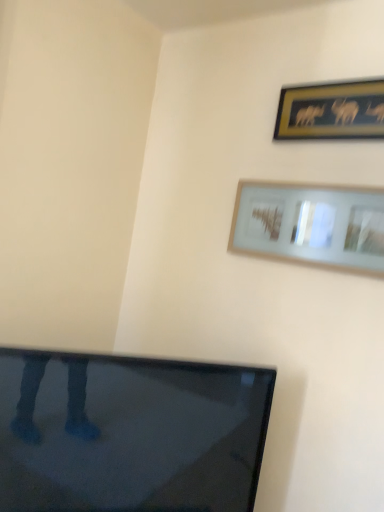
This screenshot has width=384, height=512. What do you see at coordinates (311, 224) in the screenshot?
I see `matte glass picture frame at upper right, which is the second picture frame in top-to-bottom order` at bounding box center [311, 224].

Where is `matte glass picture frame at upper right, which is the second picture frame in top-to-bottom order`? The height and width of the screenshot is (512, 384). matte glass picture frame at upper right, which is the second picture frame in top-to-bottom order is located at coordinates (311, 224).

The height and width of the screenshot is (512, 384). Describe the element at coordinates (332, 111) in the screenshot. I see `gold-framed picture at upper right, marked as the second picture frame in a bottom-to-top arrangement` at that location.

Find the location of a particular element. The image size is (384, 512). gold-framed picture at upper right, which appears as the first picture frame when viewed from the top is located at coordinates (332, 111).

This screenshot has height=512, width=384. In order to click on matte glass picture frame at upper right, which appears as the 1th picture frame when ordered from the bottom in this screenshot , I will do `click(311, 224)`.

Is gold-framed picture at upper right, which appears as the first picture frame when viewed from the top, at the left side of matte glass picture frame at upper right, which is the second picture frame in top-to-bottom order?

No, gold-framed picture at upper right, which appears as the first picture frame when viewed from the top, is not to the left of matte glass picture frame at upper right, which is the second picture frame in top-to-bottom order.

Considering their positions, is gold-framed picture at upper right, marked as the second picture frame in a bottom-to-top arrangement, located in front of or behind matte glass picture frame at upper right, which appears as the 1th picture frame when ordered from the bottom?

Visually, gold-framed picture at upper right, marked as the second picture frame in a bottom-to-top arrangement, is located behind matte glass picture frame at upper right, which appears as the 1th picture frame when ordered from the bottom.

Is point (352, 81) closer or farther from the camera than point (271, 241)?

Clearly, point (352, 81) is closer to the camera than point (271, 241).

From the image's perspective, which one is positioned higher, gold-framed picture at upper right, which appears as the first picture frame when viewed from the top, or matte glass picture frame at upper right, which appears as the 1th picture frame when ordered from the bottom?

gold-framed picture at upper right, which appears as the first picture frame when viewed from the top, is shown above in the image.

From a real-world perspective, which is physically below, gold-framed picture at upper right, which appears as the first picture frame when viewed from the top, or matte glass picture frame at upper right, which is the second picture frame in top-to-bottom order?

matte glass picture frame at upper right, which is the second picture frame in top-to-bottom order.

Based on the photo, does gold-framed picture at upper right, marked as the second picture frame in a bottom-to-top arrangement, have a lesser width compared to matte glass picture frame at upper right, which is the second picture frame in top-to-bottom order?

Correct, the width of gold-framed picture at upper right, marked as the second picture frame in a bottom-to-top arrangement, is less than that of matte glass picture frame at upper right, which is the second picture frame in top-to-bottom order.

Is gold-framed picture at upper right, which appears as the first picture frame when viewed from the top, taller or shorter than matte glass picture frame at upper right, which appears as the 1th picture frame when ordered from the bottom?

Considering their sizes, gold-framed picture at upper right, which appears as the first picture frame when viewed from the top, has less height than matte glass picture frame at upper right, which appears as the 1th picture frame when ordered from the bottom.

Looking at this image, is gold-framed picture at upper right, which appears as the first picture frame when viewed from the top, smaller than matte glass picture frame at upper right, which is the second picture frame in top-to-bottom order?

Correct, gold-framed picture at upper right, which appears as the first picture frame when viewed from the top, occupies less space than matte glass picture frame at upper right, which is the second picture frame in top-to-bottom order.

Choose the correct answer: Is gold-framed picture at upper right, which appears as the first picture frame when viewed from the top, inside matte glass picture frame at upper right, which is the second picture frame in top-to-bottom order, or outside it?

gold-framed picture at upper right, which appears as the first picture frame when viewed from the top, is not enclosed by matte glass picture frame at upper right, which is the second picture frame in top-to-bottom order.

Is gold-framed picture at upper right, marked as the second picture frame in a bottom-to-top arrangement, beside matte glass picture frame at upper right, which appears as the 1th picture frame when ordered from the bottom?

No, gold-framed picture at upper right, marked as the second picture frame in a bottom-to-top arrangement, is not in contact with matte glass picture frame at upper right, which appears as the 1th picture frame when ordered from the bottom.

Could you tell me if gold-framed picture at upper right, which appears as the first picture frame when viewed from the top, is turned towards matte glass picture frame at upper right, which is the second picture frame in top-to-bottom order?

No, gold-framed picture at upper right, which appears as the first picture frame when viewed from the top, is not aimed at matte glass picture frame at upper right, which is the second picture frame in top-to-bottom order.

How many degrees apart are the facing directions of gold-framed picture at upper right, which appears as the first picture frame when viewed from the top, and matte glass picture frame at upper right, which appears as the 1th picture frame when ordered from the bottom?

The angular difference between gold-framed picture at upper right, which appears as the first picture frame when viewed from the top, and matte glass picture frame at upper right, which appears as the 1th picture frame when ordered from the bottom, is 0.000173 degrees.

You are a GUI agent. You are given a task and a screenshot of the screen. Output one action in this format:
    pyautogui.click(x=<x>, y=<y>)
    Task: Click on the picture frame below the gold-framed picture at upper right, which appears as the first picture frame when viewed from the top (from a real-world perspective)
    Image resolution: width=384 pixels, height=512 pixels.
    Given the screenshot: What is the action you would take?
    pyautogui.click(x=311, y=224)

Is matte glass picture frame at upper right, which is the second picture frame in top-to-bottom order, to the left or to the right of gold-framed picture at upper right, which appears as the first picture frame when viewed from the top, in the image?

From the image, it's evident that matte glass picture frame at upper right, which is the second picture frame in top-to-bottom order, is to the left of gold-framed picture at upper right, which appears as the first picture frame when viewed from the top.

Relative to gold-framed picture at upper right, which appears as the first picture frame when viewed from the top, is matte glass picture frame at upper right, which appears as the 1th picture frame when ordered from the bottom, in front or behind?

matte glass picture frame at upper right, which appears as the 1th picture frame when ordered from the bottom, is in front of gold-framed picture at upper right, which appears as the first picture frame when viewed from the top.

Which point is more forward, [251,240] or [376,138]?

Positioned in front is point [376,138].

From the image's perspective, who appears lower, matte glass picture frame at upper right, which is the second picture frame in top-to-bottom order, or gold-framed picture at upper right, marked as the second picture frame in a bottom-to-top arrangement?

From the image's view, matte glass picture frame at upper right, which is the second picture frame in top-to-bottom order, is below.

From a real-world perspective, relative to gold-framed picture at upper right, marked as the second picture frame in a bottom-to-top arrangement, is matte glass picture frame at upper right, which is the second picture frame in top-to-bottom order, vertically above or below?

In terms of real-world spatial position, matte glass picture frame at upper right, which is the second picture frame in top-to-bottom order, is below gold-framed picture at upper right, marked as the second picture frame in a bottom-to-top arrangement.

Considering the relative sizes of matte glass picture frame at upper right, which appears as the 1th picture frame when ordered from the bottom, and gold-framed picture at upper right, marked as the second picture frame in a bottom-to-top arrangement, in the image provided, is matte glass picture frame at upper right, which appears as the 1th picture frame when ordered from the bottom, wider than gold-framed picture at upper right, marked as the second picture frame in a bottom-to-top arrangement,?

Indeed, matte glass picture frame at upper right, which appears as the 1th picture frame when ordered from the bottom, has a greater width compared to gold-framed picture at upper right, marked as the second picture frame in a bottom-to-top arrangement.

From the picture: Considering the relative sizes of matte glass picture frame at upper right, which is the second picture frame in top-to-bottom order, and gold-framed picture at upper right, marked as the second picture frame in a bottom-to-top arrangement, in the image provided, is matte glass picture frame at upper right, which is the second picture frame in top-to-bottom order, shorter than gold-framed picture at upper right, marked as the second picture frame in a bottom-to-top arrangement,?

No.

Looking at the image, does matte glass picture frame at upper right, which is the second picture frame in top-to-bottom order, seem bigger or smaller compared to gold-framed picture at upper right, which appears as the first picture frame when viewed from the top?

matte glass picture frame at upper right, which is the second picture frame in top-to-bottom order, is bigger than gold-framed picture at upper right, which appears as the first picture frame when viewed from the top.

From the picture: Is matte glass picture frame at upper right, which appears as the 1th picture frame when ordered from the bottom, completely or partially outside of gold-framed picture at upper right, which appears as the first picture frame when viewed from the top?

Answer: Yes, matte glass picture frame at upper right, which appears as the 1th picture frame when ordered from the bottom, is not within gold-framed picture at upper right, which appears as the first picture frame when viewed from the top.

Does matte glass picture frame at upper right, which appears as the 1th picture frame when ordered from the bottom, touch gold-framed picture at upper right, marked as the second picture frame in a bottom-to-top arrangement?

No, matte glass picture frame at upper right, which appears as the 1th picture frame when ordered from the bottom, is not making contact with gold-framed picture at upper right, marked as the second picture frame in a bottom-to-top arrangement.

Could you tell me if matte glass picture frame at upper right, which appears as the 1th picture frame when ordered from the bottom, is facing gold-framed picture at upper right, which appears as the first picture frame when viewed from the top?

No, matte glass picture frame at upper right, which appears as the 1th picture frame when ordered from the bottom, does not turn towards gold-framed picture at upper right, which appears as the first picture frame when viewed from the top.

Where is `picture frame below the gold-framed picture at upper right, marked as the second picture frame in a bottom-to-top arrangement (from the image's perspective)`? The height and width of the screenshot is (512, 384). picture frame below the gold-framed picture at upper right, marked as the second picture frame in a bottom-to-top arrangement (from the image's perspective) is located at coordinates (311, 224).

Identify the location of picture frame on the left of gold-framed picture at upper right, marked as the second picture frame in a bottom-to-top arrangement. This screenshot has width=384, height=512. (311, 224).

In the image, there is a gold-framed picture at upper right, marked as the second picture frame in a bottom-to-top arrangement. Where is `picture frame below it (from the image's perspective)`? This screenshot has height=512, width=384. picture frame below it (from the image's perspective) is located at coordinates (311, 224).